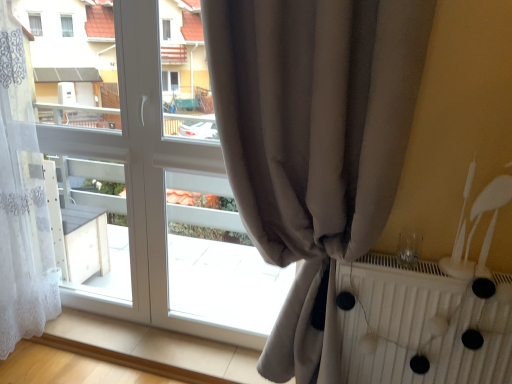
Question: Looking at their shapes, would you say white sheer curtain at left, which is counted as the 1th curtain, starting from the left, is wider or thinner than white textured radiator at right?

Choices:
 (A) thin
 (B) wide

Answer: (B)

Question: From a real-world perspective, relative to white textured radiator at right, is white sheer curtain at left, placed as the 2th curtain when sorted from right to left, vertically above or below?

Choices:
 (A) below
 (B) above

Answer: (B)

Question: Estimate the real-world distances between objects in this image. Which object is farther from the white sheer curtain at left, which is counted as the 1th curtain, starting from the left?

Choices:
 (A) white textured radiator at right
 (B) satin beige curtain at center, which is the first curtain in right-to-left order

Answer: (A)

Question: Estimate the real-world distances between objects in this image. Which object is closer to the white textured radiator at right?

Choices:
 (A) white sheer curtain at left, placed as the 2th curtain when sorted from right to left
 (B) satin beige curtain at center, placed as the second curtain when sorted from left to right

Answer: (B)